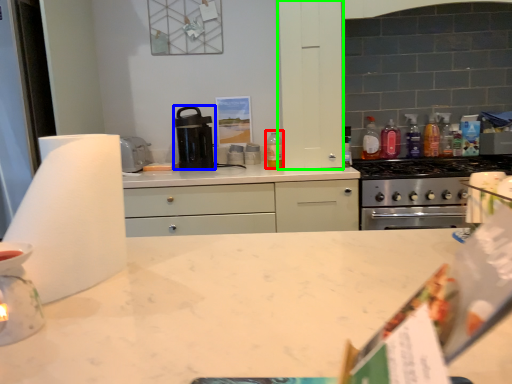
Question: Considering the real-world distances, which object is closest to bottle (highlighted by a red box)? kitchen appliance (highlighted by a blue box) or cabinetry (highlighted by a green box).

Choices:
 (A) kitchen appliance
 (B) cabinetry

Answer: (B)